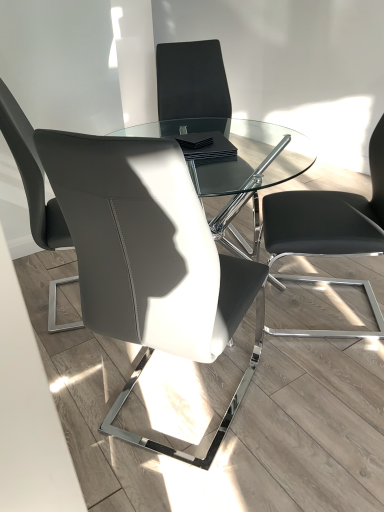
The height and width of the screenshot is (512, 384). What do you see at coordinates (192, 81) in the screenshot? I see `matte black chair at center, which is the 2th chair from right to left` at bounding box center [192, 81].

Describe the element at coordinates (31, 175) in the screenshot. The height and width of the screenshot is (512, 384). I see `matte gray leather chair at left, placed as the 4th chair when sorted from right to left` at that location.

Consider the image. Measure the distance between point (118, 289) and camera.

Point (118, 289) and camera are 1.08 meters apart.

Where is `black leather chair at right, arranged as the fourth chair when viewed from the left`? The width and height of the screenshot is (384, 512). black leather chair at right, arranged as the fourth chair when viewed from the left is located at coordinates (329, 215).

Can you tell me how much matte black chair at center, acting as the 2th chair starting from the left, and matte gray leather chair at left, the 1th chair in the left-to-right sequence, differ in facing direction?

There is a 53-degree angle between the facing directions of matte black chair at center, acting as the 2th chair starting from the left, and matte gray leather chair at left, the 1th chair in the left-to-right sequence.

Which is correct: matte black chair at center, which is the 3th chair from right to left, is inside matte gray leather chair at left, placed as the 4th chair when sorted from right to left, or outside of it?

matte black chair at center, which is the 3th chair from right to left, is not enclosed by matte gray leather chair at left, placed as the 4th chair when sorted from right to left.

Does matte black chair at center, which is the 3th chair from right to left, have a lesser width compared to matte gray leather chair at left, placed as the 4th chair when sorted from right to left?

→ In fact, matte black chair at center, which is the 3th chair from right to left, might be wider than matte gray leather chair at left, placed as the 4th chair when sorted from right to left.

Is black leather chair at right, arranged as the fourth chair when viewed from the left, located outside matte black chair at center, which is the 2th chair from right to left?

Yes, black leather chair at right, arranged as the fourth chair when viewed from the left, is not within matte black chair at center, which is the 2th chair from right to left.

Is black leather chair at right, the 1th chair positioned from the right, next to matte black chair at center, which is the 2th chair from right to left?

No, black leather chair at right, the 1th chair positioned from the right, is not next to matte black chair at center, which is the 2th chair from right to left.

What's the angular difference between black leather chair at right, arranged as the fourth chair when viewed from the left, and matte black chair at center, acting as the 3th chair starting from the left,'s facing directions?

The angular difference between black leather chair at right, arranged as the fourth chair when viewed from the left, and matte black chair at center, acting as the 3th chair starting from the left, is 113 degrees.

From the image's perspective, is matte gray leather chair at left, placed as the 4th chair when sorted from right to left, beneath matte black chair at center, acting as the 3th chair starting from the left?

Yes.

Is matte gray leather chair at left, placed as the 4th chair when sorted from right to left, bigger than matte black chair at center, which is the 2th chair from right to left?

No.

Consider the image. Is matte gray leather chair at left, placed as the 4th chair when sorted from right to left, next to matte black chair at center, which is the 2th chair from right to left?

matte gray leather chair at left, placed as the 4th chair when sorted from right to left, and matte black chair at center, which is the 2th chair from right to left, are not in contact.

Does point (374, 176) appear closer or farther from the camera than point (55, 239)?

Point (374, 176).

From the image's perspective, which is above, black leather chair at right, arranged as the fourth chair when viewed from the left, or matte gray leather chair at left, placed as the 4th chair when sorted from right to left?

matte gray leather chair at left, placed as the 4th chair when sorted from right to left.

Is black leather chair at right, the 1th chair positioned from the right, far away from matte gray leather chair at left, the 1th chair in the left-to-right sequence?

That's not correct — black leather chair at right, the 1th chair positioned from the right, is a little close to matte gray leather chair at left, the 1th chair in the left-to-right sequence.

Does black leather chair at right, arranged as the fourth chair when viewed from the left, have a greater height compared to matte gray leather chair at left, the 1th chair in the left-to-right sequence?

Incorrect, the height of black leather chair at right, arranged as the fourth chair when viewed from the left, is not larger of that of matte gray leather chair at left, the 1th chair in the left-to-right sequence.

Is matte gray leather chair at left, the 1th chair in the left-to-right sequence, far from matte black chair at center, acting as the 2th chair starting from the left?

No.

How distant is matte gray leather chair at left, placed as the 4th chair when sorted from right to left, from matte black chair at center, which is the 3th chair from right to left?

They are 24.97 inches apart.

From a real-world perspective, relative to matte black chair at center, which is the 3th chair from right to left, is matte gray leather chair at left, the 1th chair in the left-to-right sequence, vertically above or below?

matte gray leather chair at left, the 1th chair in the left-to-right sequence, is situated higher than matte black chair at center, which is the 3th chair from right to left, in the real world.

Does matte gray leather chair at left, the 1th chair in the left-to-right sequence, turn towards matte black chair at center, which is the 3th chair from right to left?

No, matte gray leather chair at left, the 1th chair in the left-to-right sequence, does not turn towards matte black chair at center, which is the 3th chair from right to left.

Between matte gray leather chair at left, placed as the 4th chair when sorted from right to left, and black leather chair at right, the 1th chair positioned from the right, which one has smaller size?

With smaller size is matte gray leather chair at left, placed as the 4th chair when sorted from right to left.

Is matte gray leather chair at left, the 1th chair in the left-to-right sequence, facing away from black leather chair at right, the 1th chair positioned from the right?

That's not correct — matte gray leather chair at left, the 1th chair in the left-to-right sequence, is not looking away from black leather chair at right, the 1th chair positioned from the right.

Is matte gray leather chair at left, the 1th chair in the left-to-right sequence, located outside black leather chair at right, the 1th chair positioned from the right?

Yes, matte gray leather chair at left, the 1th chair in the left-to-right sequence, is not within black leather chair at right, the 1th chair positioned from the right.

From the picture: Is there a large distance between matte gray leather chair at left, the 1th chair in the left-to-right sequence, and black leather chair at right, arranged as the fourth chair when viewed from the left?

No, matte gray leather chair at left, the 1th chair in the left-to-right sequence, is in close proximity to black leather chair at right, arranged as the fourth chair when viewed from the left.

Is point (241, 279) positioned before point (313, 203)?

Yes, point (241, 279) is in front of point (313, 203).

Can you confirm if matte black chair at center, acting as the 2th chair starting from the left, is positioned to the right of black leather chair at right, arranged as the fourth chair when viewed from the left?

No.

Can we say matte black chair at center, acting as the 2th chair starting from the left, lies outside black leather chair at right, arranged as the fourth chair when viewed from the left?

Yes, matte black chair at center, acting as the 2th chair starting from the left, is not within black leather chair at right, arranged as the fourth chair when viewed from the left.

Image resolution: width=384 pixels, height=512 pixels. Identify the location of the 2nd chair to the left of the black leather chair at right, the 1th chair positioned from the right, counting from the anchor's position. (150, 259).

Image resolution: width=384 pixels, height=512 pixels. Find the location of `chair on the left side of matte black chair at center, acting as the 2th chair starting from the left`. chair on the left side of matte black chair at center, acting as the 2th chair starting from the left is located at coordinates (31, 175).

Identify the location of the 2nd chair behind the black leather chair at right, the 1th chair positioned from the right. (192, 81).

When comparing their distances from matte gray leather chair at left, the 1th chair in the left-to-right sequence, does black leather chair at right, arranged as the fourth chair when viewed from the left, or matte black chair at center, which is the 3th chair from right to left, seem further?

Among the two, black leather chair at right, arranged as the fourth chair when viewed from the left, is located further to matte gray leather chair at left, the 1th chair in the left-to-right sequence.

Based on their spatial positions, is matte gray leather chair at left, placed as the 4th chair when sorted from right to left, or matte black chair at center, acting as the 2th chair starting from the left, further from matte black chair at center, acting as the 3th chair starting from the left?

matte black chair at center, acting as the 2th chair starting from the left, lies further to matte black chair at center, acting as the 3th chair starting from the left, than the other object.

Looking at the image, which one is located further to matte black chair at center, acting as the 3th chair starting from the left, black leather chair at right, the 1th chair positioned from the right, or matte black chair at center, acting as the 2th chair starting from the left?

The object further to matte black chair at center, acting as the 3th chair starting from the left, is matte black chair at center, acting as the 2th chair starting from the left.

Based on the photo, estimate the real-world distances between objects in this image. Which object is further from matte gray leather chair at left, placed as the 4th chair when sorted from right to left, matte black chair at center, which is the 2th chair from right to left, or black leather chair at right, the 1th chair positioned from the right?

black leather chair at right, the 1th chair positioned from the right.

Which object lies nearer to the anchor point matte black chair at center, acting as the 3th chair starting from the left, matte black chair at center, acting as the 2th chair starting from the left, or matte gray leather chair at left, the 1th chair in the left-to-right sequence?

matte gray leather chair at left, the 1th chair in the left-to-right sequence, lies closer to matte black chair at center, acting as the 3th chair starting from the left, than the other object.

Which object lies further to the anchor point matte black chair at center, acting as the 2th chair starting from the left, black leather chair at right, arranged as the fourth chair when viewed from the left, or matte gray leather chair at left, placed as the 4th chair when sorted from right to left?

Based on the image, black leather chair at right, arranged as the fourth chair when viewed from the left, appears to be further to matte black chair at center, acting as the 2th chair starting from the left.

When comparing their distances from matte gray leather chair at left, placed as the 4th chair when sorted from right to left, does matte black chair at center, which is the 2th chair from right to left, or matte black chair at center, which is the 3th chair from right to left, seem further?

matte black chair at center, which is the 2th chair from right to left, is positioned further to the anchor matte gray leather chair at left, placed as the 4th chair when sorted from right to left.

Looking at the image, which one is located further to black leather chair at right, the 1th chair positioned from the right, matte gray leather chair at left, placed as the 4th chair when sorted from right to left, or matte black chair at center, acting as the 3th chair starting from the left?

The object further to black leather chair at right, the 1th chair positioned from the right, is matte gray leather chair at left, placed as the 4th chair when sorted from right to left.